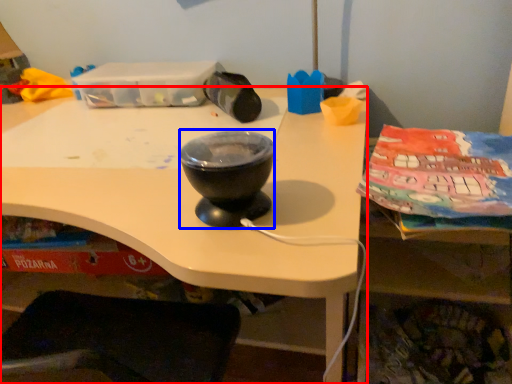
Question: Which of the following is the closest to the observer, desk (highlighted by a red box) or basin (highlighted by a blue box)?

Choices:
 (A) desk
 (B) basin

Answer: (A)